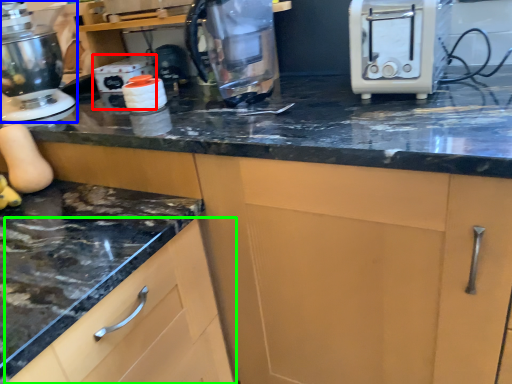
Question: Which is farther away from appliance (highlighted by a red box)? home appliance (highlighted by a blue box) or cabinetry (highlighted by a green box)?

Choices:
 (A) home appliance
 (B) cabinetry

Answer: (B)